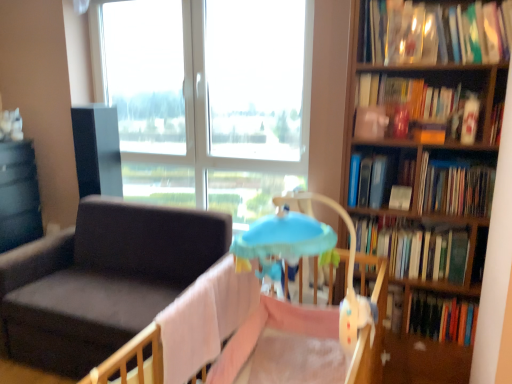
Question: Would you say matte black table at left contains transparent glass window at upper center?

Choices:
 (A) no
 (B) yes

Answer: (A)

Question: Is matte black table at left oriented away from transparent glass window at upper center?

Choices:
 (A) no
 (B) yes

Answer: (A)

Question: Is matte black table at left not inside transparent glass window at upper center?

Choices:
 (A) yes
 (B) no

Answer: (A)

Question: Can you confirm if matte black table at left is bigger than transparent glass window at upper center?

Choices:
 (A) no
 (B) yes

Answer: (A)

Question: Considering the relative positions of matte black table at left and transparent glass window at upper center in the image provided, is matte black table at left to the left of transparent glass window at upper center from the viewer's perspective?

Choices:
 (A) no
 (B) yes

Answer: (B)

Question: Would you consider matte black table at left to be distant from transparent glass window at upper center?

Choices:
 (A) yes
 (B) no

Answer: (A)

Question: From the image's perspective, is hardcover book at upper right, which is counted as the third book, starting from the bottom, beneath transparent glass window at upper center?

Choices:
 (A) no
 (B) yes

Answer: (B)

Question: Does hardcover book at upper right, which is counted as the third book, starting from the bottom, turn towards transparent glass window at upper center?

Choices:
 (A) yes
 (B) no

Answer: (B)

Question: Is hardcover book at upper right, which is counted as the third book, starting from the top, with transparent glass window at upper center?

Choices:
 (A) yes
 (B) no

Answer: (B)

Question: Is there a large distance between hardcover book at upper right, which is counted as the third book, starting from the top, and transparent glass window at upper center?

Choices:
 (A) yes
 (B) no

Answer: (A)

Question: Considering the relative positions of hardcover book at upper right, which is counted as the third book, starting from the bottom, and transparent glass window at upper center in the image provided, is hardcover book at upper right, which is counted as the third book, starting from the bottom, to the left of transparent glass window at upper center from the viewer's perspective?

Choices:
 (A) yes
 (B) no

Answer: (B)

Question: From the image's perspective, is hardcover book at upper right, which is counted as the third book, starting from the bottom, over transparent glass window at upper center?

Choices:
 (A) no
 (B) yes

Answer: (A)

Question: From a real-world perspective, is matte black table at left positioned under hardcover book at right, positioned as the 2th book in bottom-to-top order, based on gravity?

Choices:
 (A) no
 (B) yes

Answer: (B)